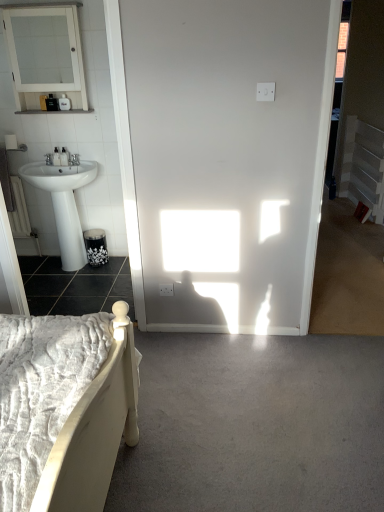
Where is `free spot to the right of matte black soap dispenser at left, positioned as the 1th toiletry in bottom-to-top order`? free spot to the right of matte black soap dispenser at left, positioned as the 1th toiletry in bottom-to-top order is located at coordinates (81, 165).